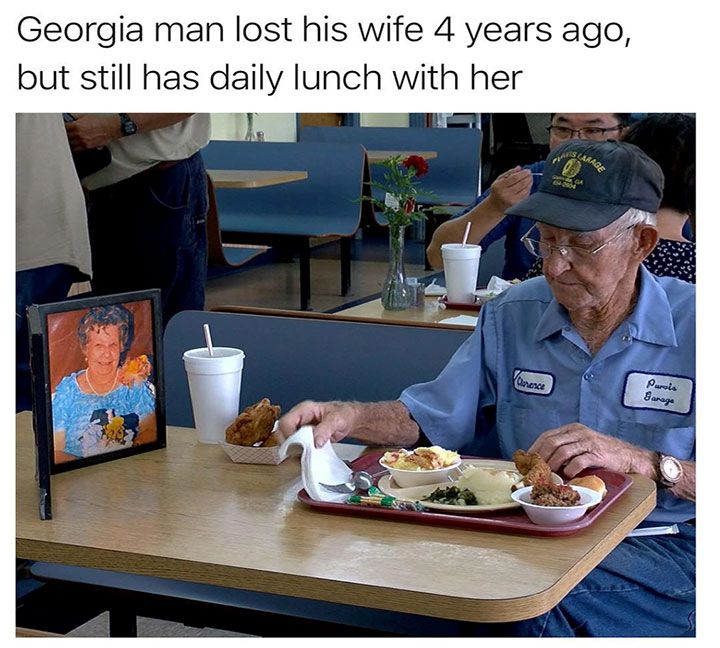
Locate an element on the screen. silver lunch tray is located at coordinates (536, 527).